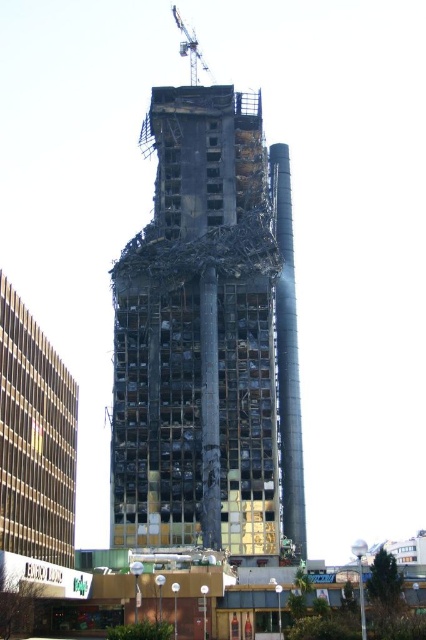
Question: Does charcoal concrete tower at center have a smaller size compared to metallic gray crane at upper center?

Choices:
 (A) no
 (B) yes

Answer: (A)

Question: Does charcoal concrete tower at center have a smaller size compared to metallic gray crane at upper center?

Choices:
 (A) yes
 (B) no

Answer: (B)

Question: Which of the following is the closest to the observer?

Choices:
 (A) charcoal concrete tower at center
 (B) metallic gray crane at upper center

Answer: (A)

Question: Which of the following is the farthest from the observer?

Choices:
 (A) (224, 483)
 (B) (195, 77)

Answer: (B)

Question: Is charcoal concrete tower at center bigger than metallic gray crane at upper center?

Choices:
 (A) yes
 (B) no

Answer: (A)